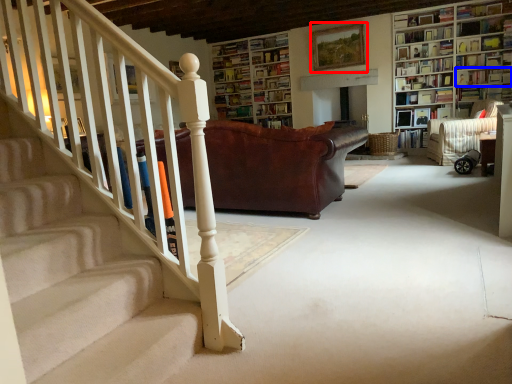
Question: Among these objects, which one is nearest to the camera, picture frame (highlighted by a red box) or book (highlighted by a blue box)?

Choices:
 (A) picture frame
 (B) book

Answer: (B)